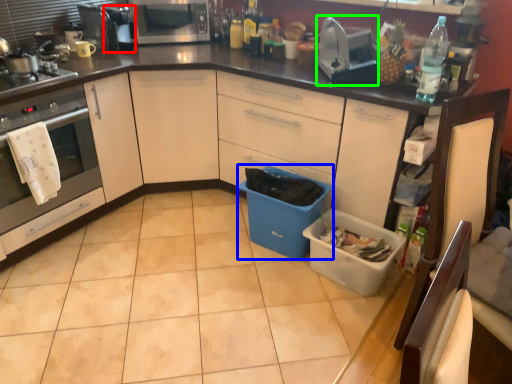
Question: Considering the real-world distances, which object is farthest from appliance (highlighted by a red box)? storage box (highlighted by a blue box) or appliance (highlighted by a green box)?

Choices:
 (A) storage box
 (B) appliance

Answer: (A)